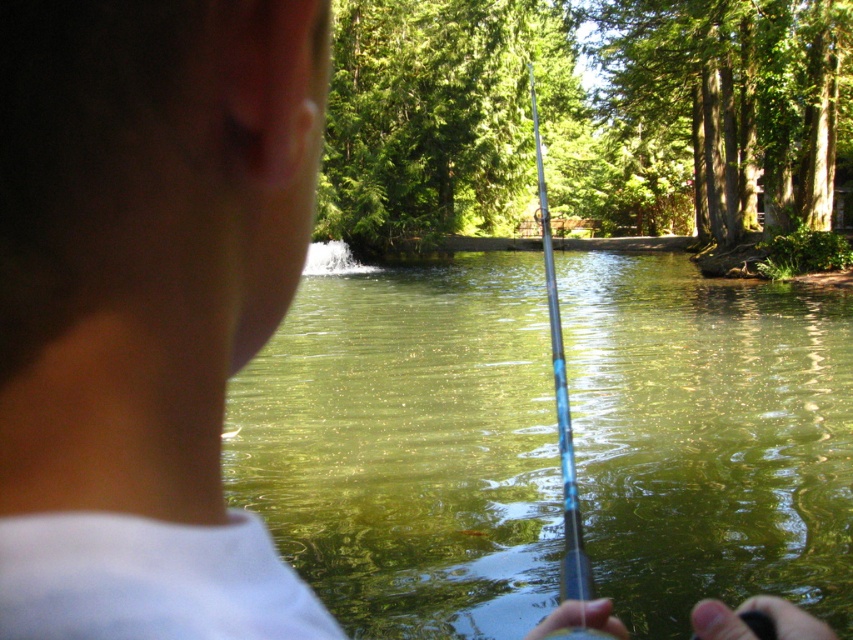
Question: Can you confirm if green translucent water at center is bigger than blue glossy fishing pole at center?

Choices:
 (A) yes
 (B) no

Answer: (B)

Question: Where is green translucent water at center located in relation to blue glossy fishing pole at center in the image?

Choices:
 (A) below
 (B) above

Answer: (A)

Question: Which of the following is the closest to the observer?

Choices:
 (A) (582, 378)
 (B) (578, 556)

Answer: (B)

Question: In this image, where is green translucent water at center located relative to blue glossy fishing pole at center?

Choices:
 (A) left
 (B) right

Answer: (A)

Question: Among these objects, which one is farthest from the camera?

Choices:
 (A) blue glossy fishing pole at center
 (B) green translucent water at center

Answer: (A)